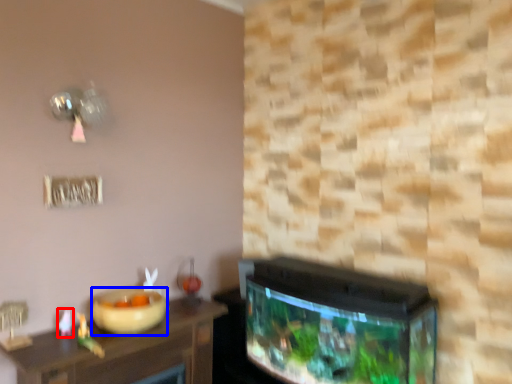
Question: Which point is closer to the camera, toy (highlighted by a red box) or bowl (highlighted by a blue box)?

Choices:
 (A) toy
 (B) bowl

Answer: (B)